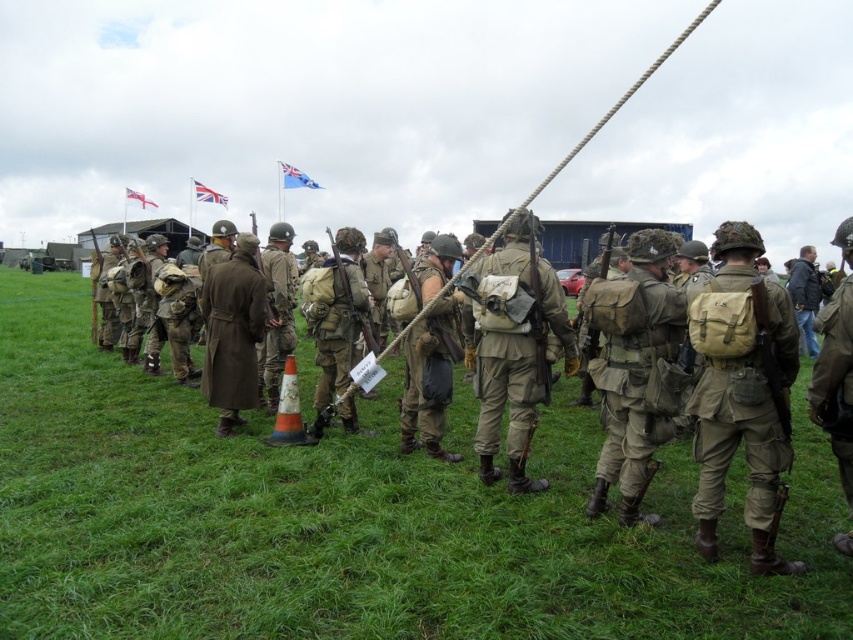
Which of these two, camouflage fabric backpack at center right or brown wool coat at center, stands shorter?

Standing shorter between the two is camouflage fabric backpack at center right.

Who is higher up, camouflage fabric backpack at center right or brown wool coat at center?

brown wool coat at center is above.

Between point (634, 410) and point (248, 330), which one is positioned in front?

Positioned in front is point (634, 410).

You are a GUI agent. You are given a task and a screenshot of the screen. Output one action in this format:
    pyautogui.click(x=<x>, y=<y>)
    Task: Click on the camouflage fabric backpack at center right
    This screenshot has height=640, width=853.
    Given the screenshot: What is the action you would take?
    pyautogui.click(x=635, y=378)

Is brown wool coat at center thinner than blue fabric flag at upper center?

Indeed, brown wool coat at center has a lesser width compared to blue fabric flag at upper center.

Between point (222, 387) and point (299, 177), which one is positioned behind?

Point (299, 177)

Where is `brown wool coat at center`? This screenshot has height=640, width=853. brown wool coat at center is located at coordinates (231, 332).

Who is positioned more to the right, green grassy at center or union jack fabric flag at upper center?

green grassy at center

Which is behind, point (1, 346) or point (218, 193)?

The point (218, 193) is more distant.

The height and width of the screenshot is (640, 853). What are the coordinates of `green grassy at center` in the screenshot? It's located at (352, 516).